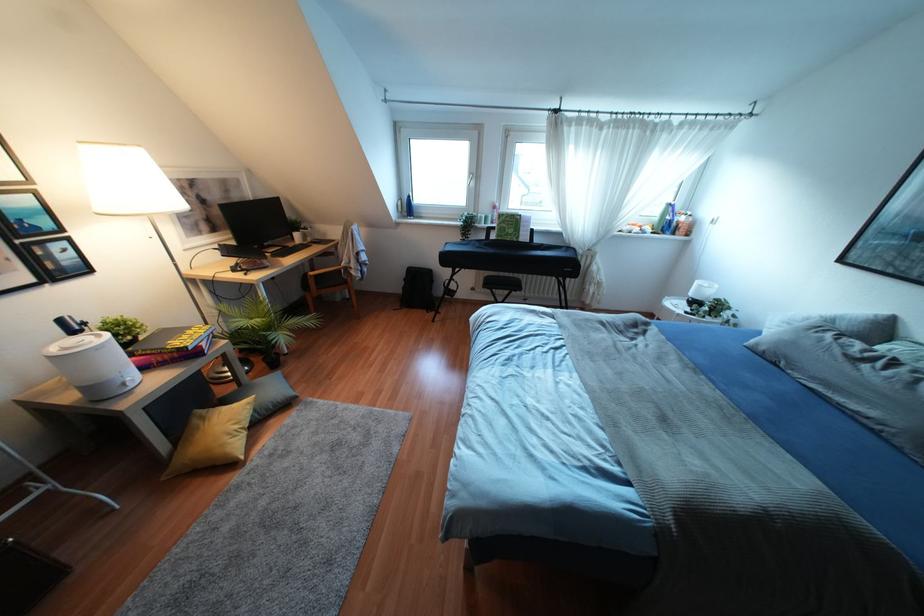
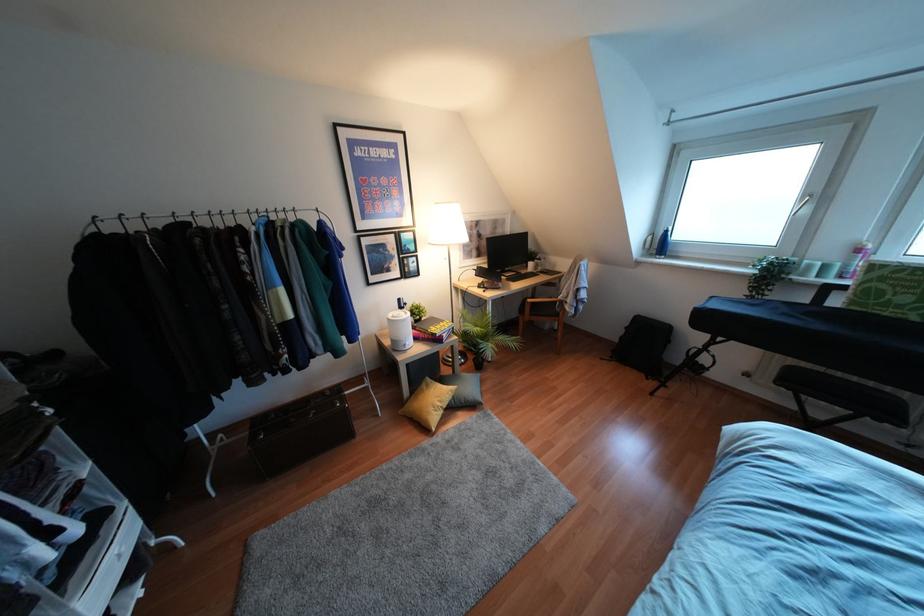
Find the pixel in the second image that matches (130,385) in the first image.

(407, 347)